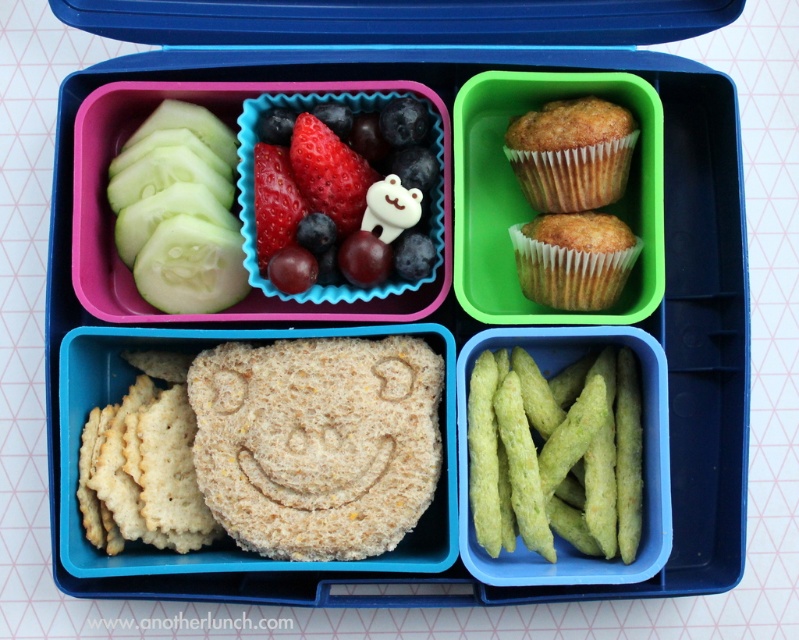
You are packing a lunchbox and want to place both the matte plastic container at upper right and the green smooth cucumber slices at left into a storage container. Which one should you place first if you want to fit both items?

You should place the green smooth cucumber slices at left first because the matte plastic container at upper right is wider and needs more space. By placing the smaller item first, there will be enough room left for the larger container.